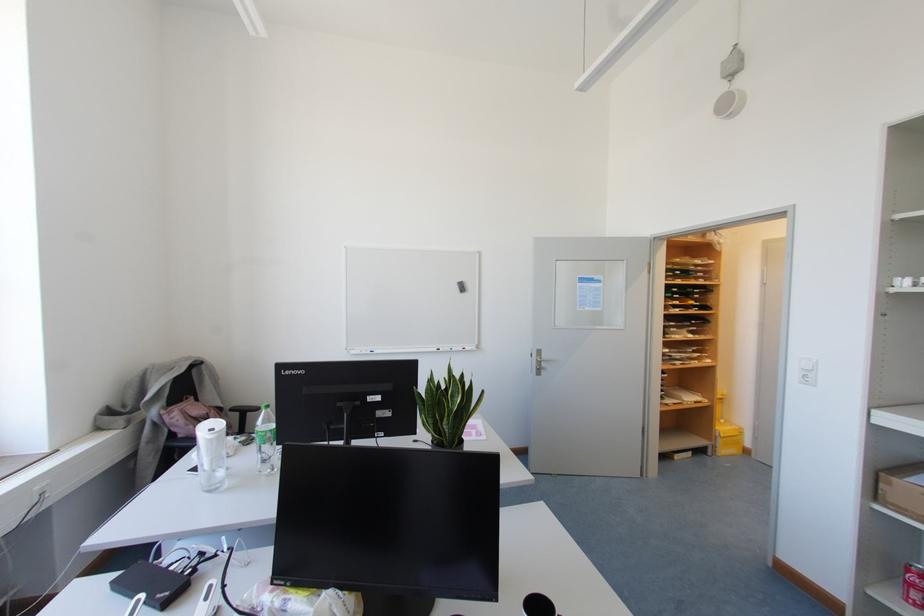
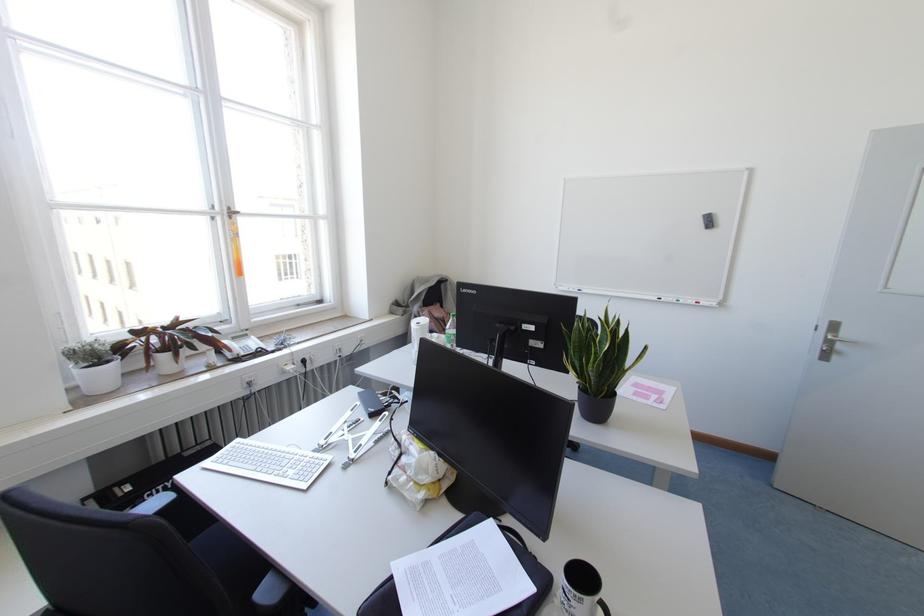
Locate, in the second image, the point that corresponds to pixel 371 351 in the first image.

(578, 290)